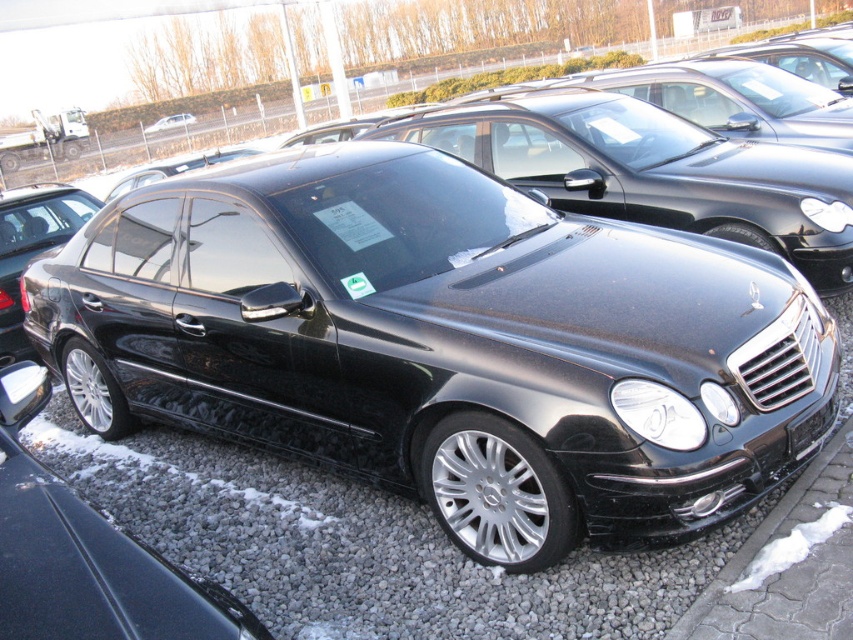
Question: Does glossy black sedan at center appear under matte black sedan at center?

Choices:
 (A) no
 (B) yes

Answer: (B)

Question: Which point appears closest to the camera in this image?

Choices:
 (A) (688, 557)
 (B) (0, 252)
 (C) (569, 280)
 (D) (163, 129)

Answer: (A)

Question: Estimate the real-world distances between objects in this image. Which object is farther from the shiny black sedan at center?

Choices:
 (A) matte black sedan at center
 (B) glossy black sedan at center
 (C) gray gravel at lower center

Answer: (A)

Question: Is glossy black sedan at center to the left of gray gravel at lower center from the viewer's perspective?

Choices:
 (A) no
 (B) yes

Answer: (A)

Question: Is shiny black sedan at center bigger than matte black sedan at center?

Choices:
 (A) no
 (B) yes

Answer: (B)

Question: Which of the following is the closest to the observer?

Choices:
 (A) (183, 115)
 (B) (21, 262)
 (C) (259, 522)
 (D) (436, 387)

Answer: (D)